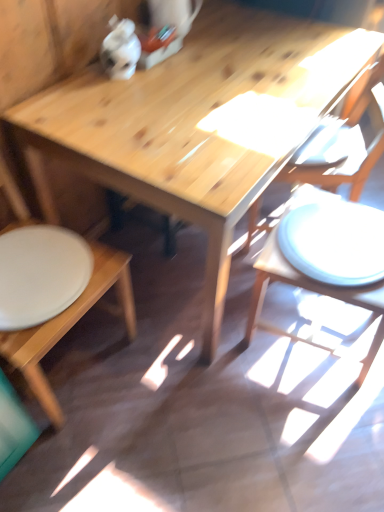
The width and height of the screenshot is (384, 512). Find the location of `free space that is in between wooden chair at lower left, which is the 2th chair from right to left, and wooden table at center`. free space that is in between wooden chair at lower left, which is the 2th chair from right to left, and wooden table at center is located at coordinates (137, 376).